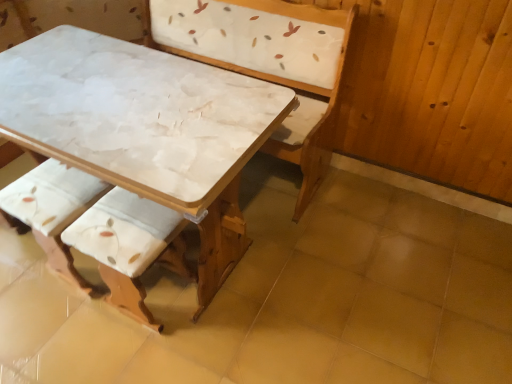
This screenshot has width=512, height=384. What are the coordinates of `spots to the right of white marble table at center` in the screenshot? It's located at (340, 276).